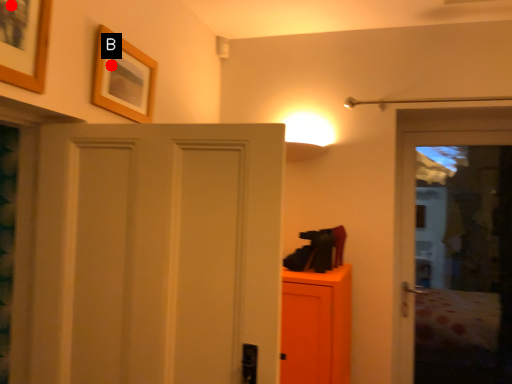
Question: Two points are circled on the image, labeled by A and B beside each circle. Which point is closer to the camera taking this photo?

Choices:
 (A) A is closer
 (B) B is closer

Answer: (A)